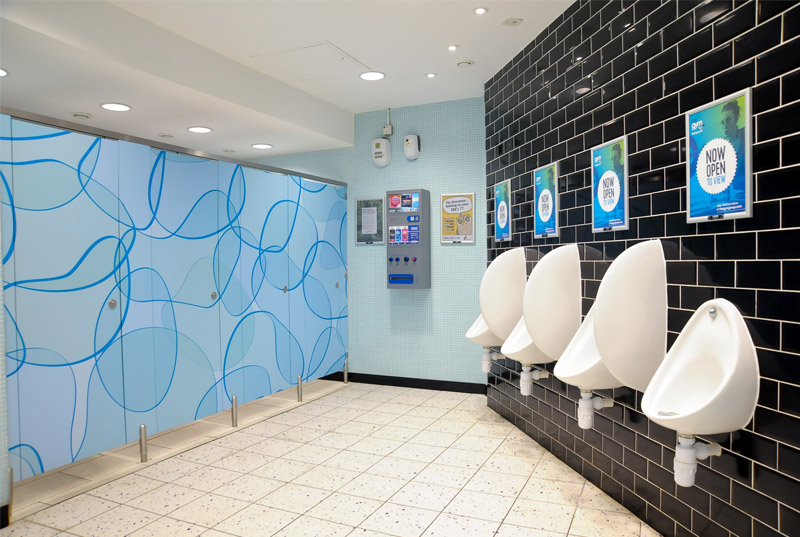
Where is `poster`? This screenshot has height=537, width=800. poster is located at coordinates (724, 128), (608, 159), (542, 179), (505, 197), (462, 206), (372, 216).